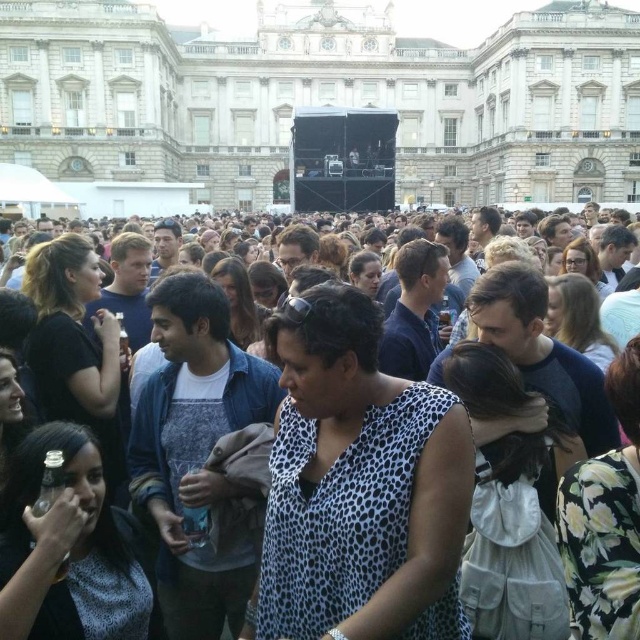
Question: Which point is closer to the camera?

Choices:
 (A) white stone building at center
 (B) leopard print dress at center

Answer: (B)

Question: Which point is closer to the camera?

Choices:
 (A) (307, 68)
 (B) (337, 216)

Answer: (B)

Question: Among these objects, which one is farthest from the camera?

Choices:
 (A) white stone building at center
 (B) leopard print dress at center

Answer: (A)

Question: Can you confirm if white stone building at center is positioned above leopard print dress at center?

Choices:
 (A) no
 (B) yes

Answer: (B)

Question: Can you confirm if white stone building at center is positioned below leopard print dress at center?

Choices:
 (A) no
 (B) yes

Answer: (A)

Question: Does white stone building at center appear under leopard print dress at center?

Choices:
 (A) yes
 (B) no

Answer: (B)